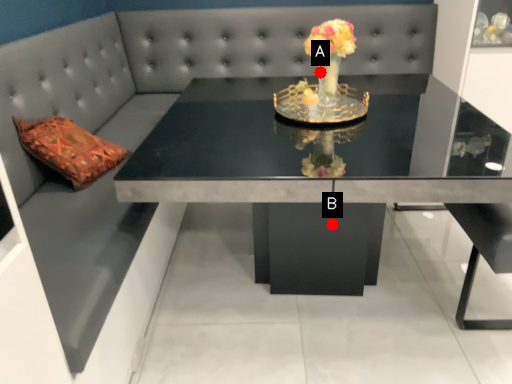
Question: Two points are circled on the image, labeled by A and B beside each circle. Which point appears closest to the camera in this image?

Choices:
 (A) A is closer
 (B) B is closer

Answer: (B)